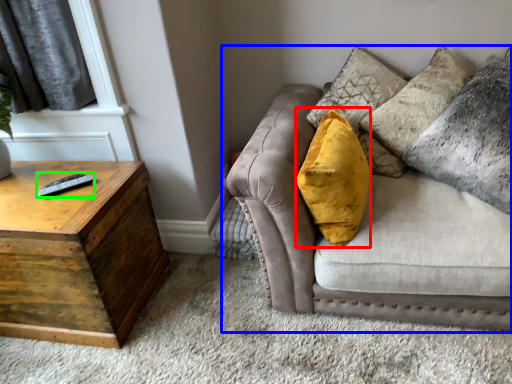
Question: Which is farther away from throw pillow (highlighted by a red box)? studio couch (highlighted by a blue box) or remote (highlighted by a green box)?

Choices:
 (A) studio couch
 (B) remote

Answer: (B)